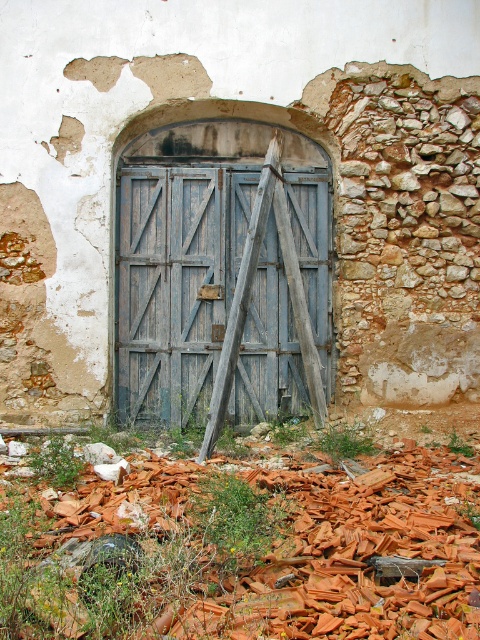
Question: Which point is farther to the camera?

Choices:
 (A) (314, 266)
 (B) (279, 621)

Answer: (A)

Question: Where is orange clay tiles at center located in relation to blue wooden door at center in the image?

Choices:
 (A) right
 (B) left

Answer: (A)

Question: Which object appears farthest from the camera in this image?

Choices:
 (A) orange clay tiles at center
 (B) blue wooden door at center

Answer: (B)

Question: Can you confirm if orange clay tiles at center is smaller than blue wooden door at center?

Choices:
 (A) no
 (B) yes

Answer: (A)

Question: Can you confirm if orange clay tiles at center is positioned to the left of blue wooden door at center?

Choices:
 (A) no
 (B) yes

Answer: (A)

Question: Which object is farther from the camera taking this photo?

Choices:
 (A) blue wooden door at center
 (B) orange clay tiles at center

Answer: (A)